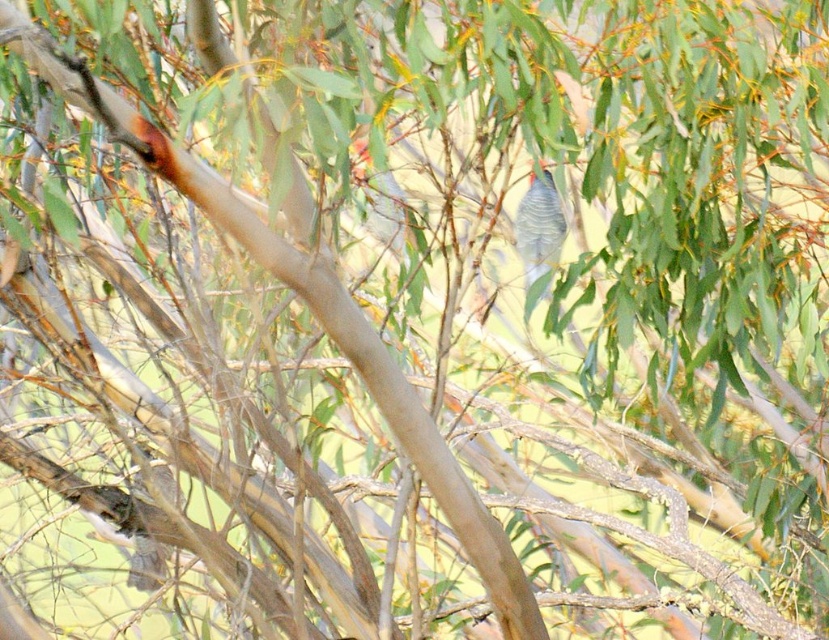
Which is in front, point (134, 545) or point (379, 221)?

Point (134, 545) is in front.

From the picture: Does brown speckled feathers at lower left appear under speckled gray bird at center?

Correct, brown speckled feathers at lower left is located below speckled gray bird at center.

Where is `brown speckled feathers at lower left`? The height and width of the screenshot is (640, 829). brown speckled feathers at lower left is located at coordinates (146, 563).

Image resolution: width=829 pixels, height=640 pixels. Describe the element at coordinates (539, 225) in the screenshot. I see `blue-gray feathers at center` at that location.

Who is positioned more to the right, blue-gray feathers at center or brown speckled feathers at lower left?

blue-gray feathers at center

At what (x,y) coordinates should I click in order to perform the action: click on blue-gray feathers at center. Please return your answer as a coordinate pair (x, y). Looking at the image, I should click on (539, 225).

The width and height of the screenshot is (829, 640). Identify the location of blue-gray feathers at center. (539, 225).

Can you confirm if blue-gray feathers at center is wider than speckled gray bird at center?

Yes.

Is point (529, 272) more distant than point (361, 177)?

Yes, it is behind point (361, 177).

Image resolution: width=829 pixels, height=640 pixels. I want to click on blue-gray feathers at center, so click(x=539, y=225).